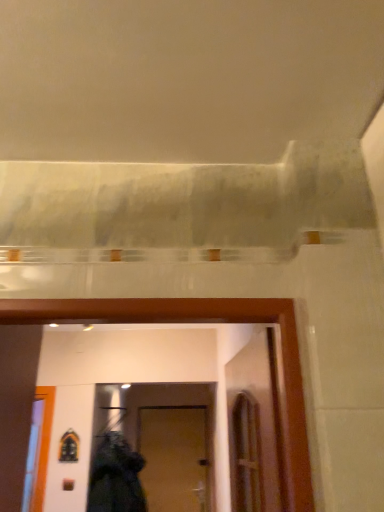
Image resolution: width=384 pixels, height=512 pixels. Describe the element at coordinates (174, 458) in the screenshot. I see `wooden door at center` at that location.

The height and width of the screenshot is (512, 384). I want to click on wooden door at center, so click(174, 458).

What do you see at coordinates (116, 477) in the screenshot? I see `black fabric at lower center` at bounding box center [116, 477].

Where is `black fabric at lower center`? black fabric at lower center is located at coordinates (116, 477).

Locate an element on the screen. The width and height of the screenshot is (384, 512). wooden door at center is located at coordinates (174, 458).

Considering the positions of objects black fabric at lower center and wooden door at center in the image provided, who is more to the right, black fabric at lower center or wooden door at center?

Result: From the viewer's perspective, wooden door at center appears more on the right side.

Is black fabric at lower center in front of wooden door at center?

Yes, black fabric at lower center is closer to the viewer.

Is point (109, 434) farther from camera compared to point (199, 406)?

No, it is in front of (199, 406).

Based on the photo, from the image's perspective, between black fabric at lower center and wooden door at center, who is located below?

wooden door at center is shown below in the image.

From a real-world perspective, between black fabric at lower center and wooden door at center, who is vertically higher?

black fabric at lower center.

Is black fabric at lower center wider than wooden door at center?

Yes.

Is black fabric at lower center taller than wooden door at center?

No, black fabric at lower center is not taller than wooden door at center.

Does black fabric at lower center have a smaller size compared to wooden door at center?

Actually, black fabric at lower center might be larger than wooden door at center.

Would you say wooden door at center is part of black fabric at lower center's contents?

Definitely not — wooden door at center is not inside black fabric at lower center.

Is black fabric at lower center far away from wooden door at center?

Actually, black fabric at lower center and wooden door at center are a little close together.

Is black fabric at lower center oriented away from wooden door at center?

Yes, black fabric at lower center's orientation is away from wooden door at center.

How different are the orientations of black fabric at lower center and wooden door at center in degrees?

The facing directions of black fabric at lower center and wooden door at center are 4.08 degrees apart.

Identify the location of clothing in front of the wooden door at center. (116, 477).

Which object is positioned more to the right, wooden door at center or black fabric at lower center?

Positioned to the right is wooden door at center.

Which is in front, wooden door at center or black fabric at lower center?

black fabric at lower center is closer to the camera.

Is point (193, 419) closer or farther from the camera than point (138, 510)?

Point (193, 419) is positioned farther from the camera compared to point (138, 510).

From the image's perspective, would you say wooden door at center is shown under black fabric at lower center?

Yes, from the image's perspective, wooden door at center is beneath black fabric at lower center.

From a real-world perspective, is wooden door at center over black fabric at lower center?

No.

Is wooden door at center thinner than black fabric at lower center?

Yes.

Consider the image. Is wooden door at center taller or shorter than black fabric at lower center?

wooden door at center is taller than black fabric at lower center.

Consider the image. Who is smaller, wooden door at center or black fabric at lower center?

With smaller size is wooden door at center.

Is wooden door at center not within black fabric at lower center?

wooden door at center lies outside black fabric at lower center's area.

Can you see wooden door at center touching black fabric at lower center?

wooden door at center and black fabric at lower center are not in contact.

Could you tell me if wooden door at center is turned towards black fabric at lower center?

Yes, wooden door at center is aimed at black fabric at lower center.

In the scene shown: How different are the orientations of wooden door at center and black fabric at lower center in degrees?

4.08 degrees.

This screenshot has width=384, height=512. What are the coordinates of `clothing above the wooden door at center (from the image's perspective)` in the screenshot? It's located at (116, 477).

Identify the location of door lying on the right of black fabric at lower center. (174, 458).

In order to click on clothing that appears in front of the wooden door at center in this screenshot , I will do `click(116, 477)`.